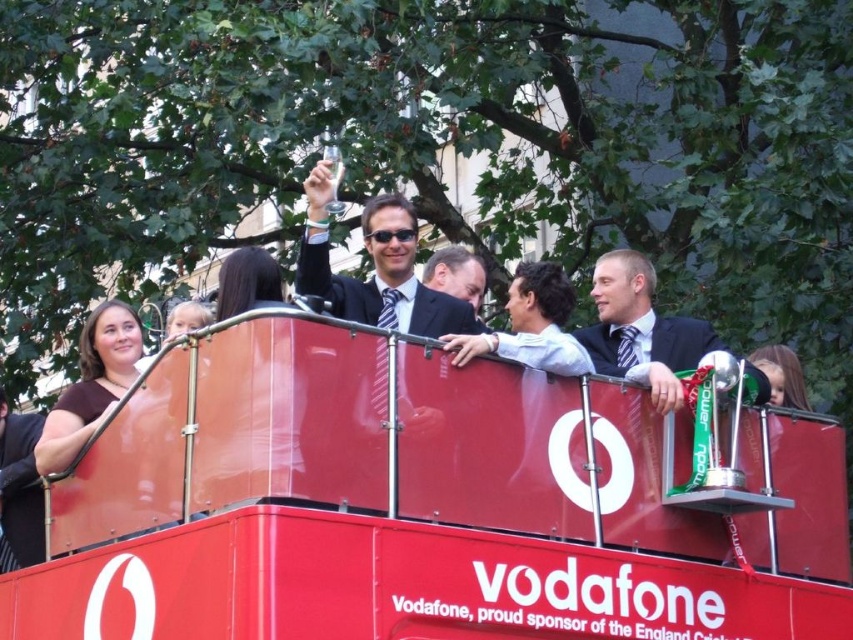
Is point (408, 316) positioned before point (624, 352)?

Yes.

Does matte black suit at center come behind matte black suit at right?

Yes, it is.

The width and height of the screenshot is (853, 640). I want to click on matte black suit at center, so click(375, 266).

This screenshot has width=853, height=640. What are the coordinates of `matte black suit at center` in the screenshot? It's located at (375, 266).

Between point (270, 465) and point (442, 330), which one is positioned in front?

Point (270, 465)

Is point (416, 428) positioned after point (379, 256)?

No.

You are a GUI agent. You are given a task and a screenshot of the screen. Output one action in this format:
    pyautogui.click(x=<x>, y=<y>)
    Task: Click on the shiny red bus at center
    The height and width of the screenshot is (640, 853).
    Given the screenshot: What is the action you would take?
    424,504

Does shiny red bus at center have a lesser width compared to matte black suit at right?

In fact, shiny red bus at center might be wider than matte black suit at right.

Is point (344, 628) behind point (759, 388)?

No.

This screenshot has width=853, height=640. In order to click on shiny red bus at center in this screenshot , I will do `click(424, 504)`.